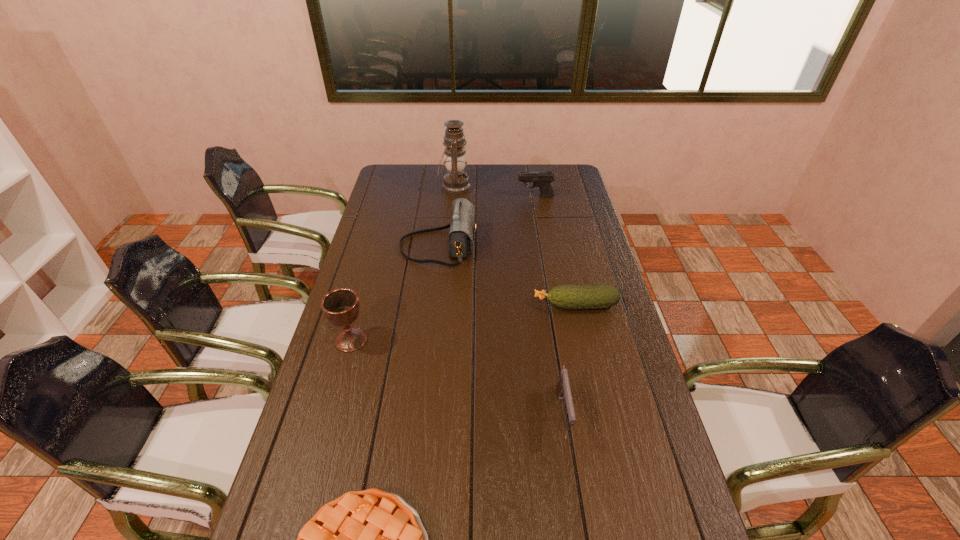
You are a GUI agent. You are given a task and a screenshot of the screen. Output one action in this format:
    pyautogui.click(x=<x>, y=<y>)
    Task: Click on the empty space between the oil lamp and the fifth nearest object
    
    Given the screenshot: What is the action you would take?
    pyautogui.click(x=446, y=217)

You are a GUI agent. You are given a task and a screenshot of the screen. Output one action in this format:
    pyautogui.click(x=<x>, y=<y>)
    Task: Click on the object that is the fifth closest one to the oil lamp
    
    Given the screenshot: What is the action you would take?
    pyautogui.click(x=563, y=386)

Point out which object is positioned as the second nearest to the nearest object. Please provide its 2D coordinates. Your answer should be formatted as a tuple, i.e. [(x, y)], where the tuple contains the x and y coordinates of a point satisfying the conditions above.

[(340, 306)]

At what (x,y) coordinates should I click in order to perform the action: click on blank space that satisfies the following two spatial constraints: 1. at the blossom end of the cucumber; 2. at the barrel of the nearer pistol. Please return your answer as a coordinate pair (x, y). The width and height of the screenshot is (960, 540). Looking at the image, I should click on (600, 412).

Image resolution: width=960 pixels, height=540 pixels. Identify the location of vacant space that satisfies the following two spatial constraints: 1. on the back side of the shoulder bag; 2. on the left side of the tallest object. (444, 186).

You are a GUI agent. You are given a task and a screenshot of the screen. Output one action in this format:
    pyautogui.click(x=<x>, y=<y>)
    Task: Click on the vacant space that satisfies the following two spatial constraints: 1. on the back side of the fifth nearest object; 2. on the right side of the fifth farthest object
    
    Given the screenshot: What is the action you would take?
    pyautogui.click(x=377, y=247)